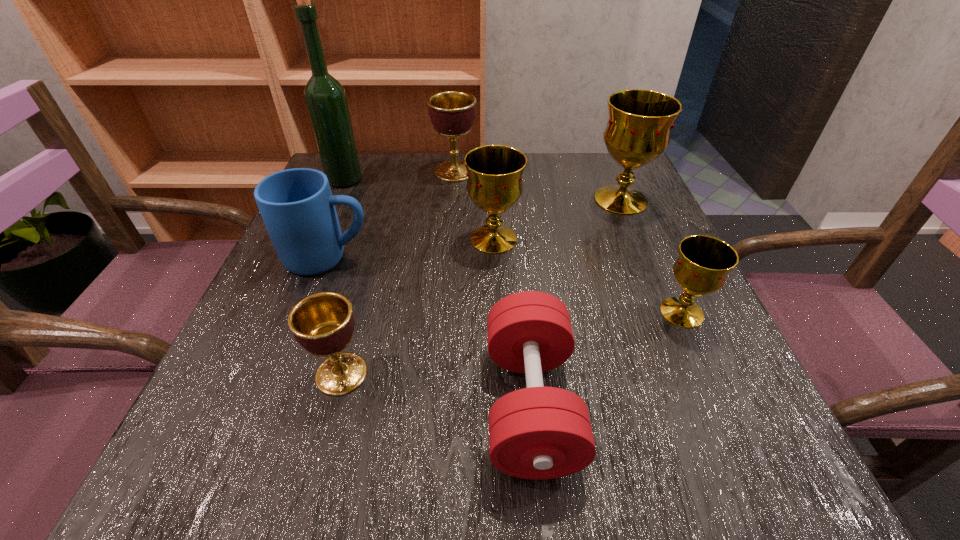
You are a GUI agent. You are given a task and a screenshot of the screen. Output one action in this format:
    pyautogui.click(x=<x>, y=<y>)
    Task: Click on the free point that satisfies the following two spatial constraints: 1. on the front side of the green liquor; 2. on the left side of the leftmost gold chalice
    
    Given the screenshot: What is the action you would take?
    pyautogui.click(x=319, y=239)

Image resolution: width=960 pixels, height=540 pixels. In order to click on vacant region that satisfies the following two spatial constraints: 1. on the back side of the bigger golden chalice; 2. on the left side of the smaller golden chalice in this screenshot , I will do `click(396, 171)`.

Locate an element on the screen. free point that satisfies the following two spatial constraints: 1. on the side of the dumbbell with the handle; 2. on the right side of the blue mug is located at coordinates (272, 404).

This screenshot has width=960, height=540. Identify the location of free space in the image that satisfies the following two spatial constraints: 1. on the front side of the nearest gold chalice; 2. on the right side of the tallest chalice. (668, 312).